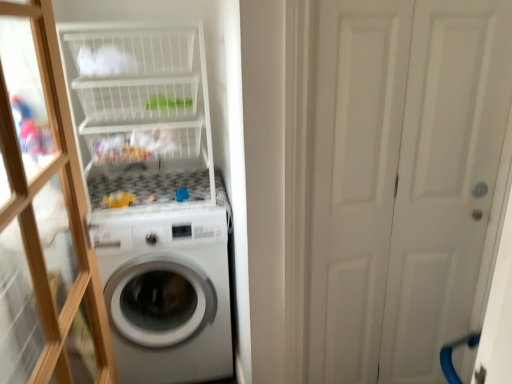
Question: From the image's perspective, is white glossy washing machine at center located beneath transparent glass door at left?

Choices:
 (A) no
 (B) yes

Answer: (B)

Question: Does white glossy washing machine at center have a lesser height compared to transparent glass door at left?

Choices:
 (A) yes
 (B) no

Answer: (A)

Question: Is the position of white glossy washing machine at center more distant than that of transparent glass door at left?

Choices:
 (A) no
 (B) yes

Answer: (B)

Question: From a real-world perspective, is white glossy washing machine at center beneath transparent glass door at left?

Choices:
 (A) yes
 (B) no

Answer: (A)

Question: Considering the relative sizes of white glossy washing machine at center and transparent glass door at left in the image provided, is white glossy washing machine at center smaller than transparent glass door at left?

Choices:
 (A) no
 (B) yes

Answer: (A)

Question: Does white glossy washing machine at center have a lesser width compared to transparent glass door at left?

Choices:
 (A) no
 (B) yes

Answer: (A)

Question: Is white wire basket at upper left further to the viewer compared to white matte door at right?

Choices:
 (A) yes
 (B) no

Answer: (A)

Question: From the image's perspective, would you say white wire basket at upper left is shown under white matte door at right?

Choices:
 (A) yes
 (B) no

Answer: (B)

Question: Does white wire basket at upper left come in front of white matte door at right?

Choices:
 (A) yes
 (B) no

Answer: (B)

Question: Can you confirm if white wire basket at upper left is positioned to the left of white matte door at right?

Choices:
 (A) no
 (B) yes

Answer: (B)

Question: Can you confirm if white wire basket at upper left is positioned to the right of white matte door at right?

Choices:
 (A) yes
 (B) no

Answer: (B)

Question: Is white wire basket at upper left positioned far away from white matte door at right?

Choices:
 (A) yes
 (B) no

Answer: (B)

Question: Can you confirm if transparent glass door at left is wider than white matte door at right?

Choices:
 (A) yes
 (B) no

Answer: (A)